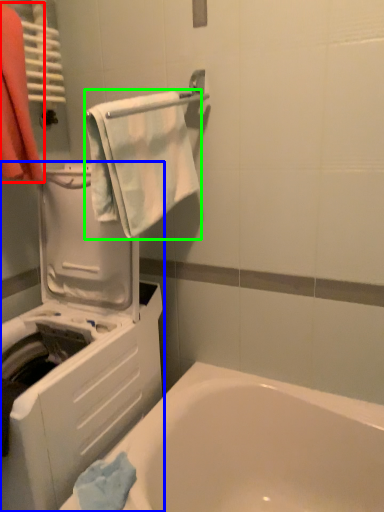
Question: Which is farther away from laundry (highlighted by a red box)? washing machine (highlighted by a blue box) or towel/napkin (highlighted by a green box)?

Choices:
 (A) washing machine
 (B) towel/napkin

Answer: (A)